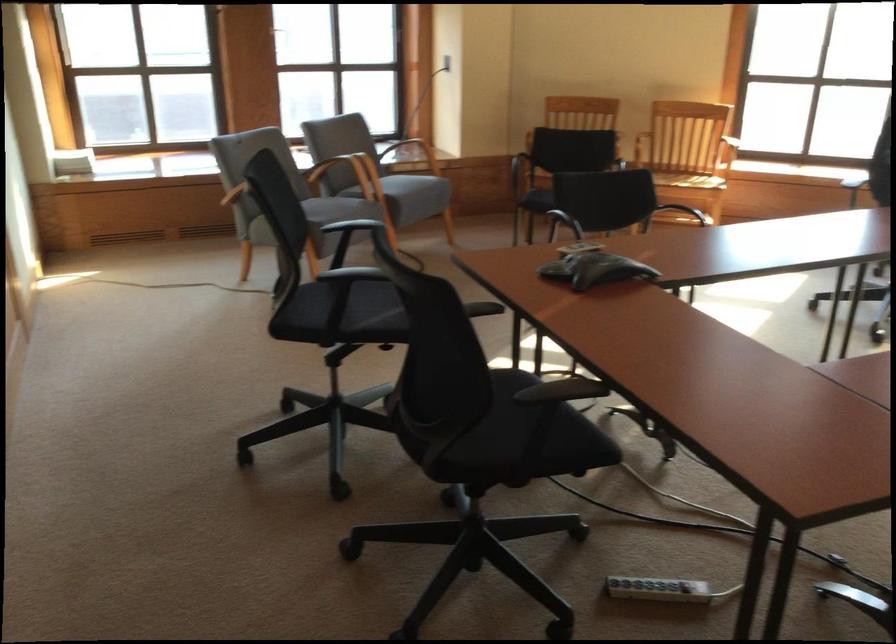
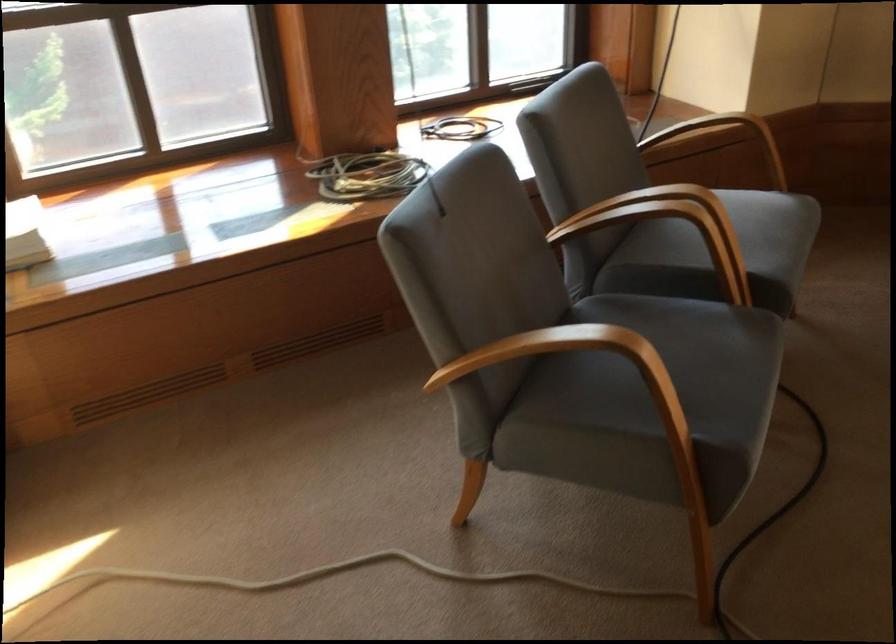
Where in the second image is the point corresponding to (x=309, y=204) from the first image?

(650, 398)